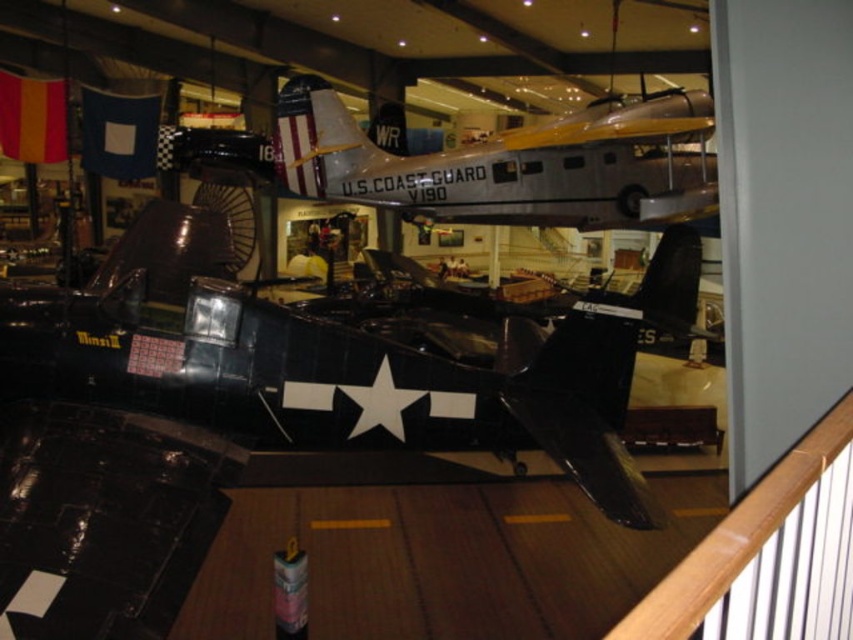
You are a museum guide explaining the layout of the exhibit. You need to inform visitors about the spatial relationship between the shiny black airplane at center and the silver metallic airplane at center. Based on their sizes, which airplane would require more horizontal space if placed side by side on the same display platform?

The silver metallic airplane at center requires more horizontal space because its width is greater than the shiny black airplane at center.

You are a visitor in the museum and want to take a photo of both the shiny black airplane at center and the silver metallic airplane at center. However, you notice that one of them is blocking your view of the other. Which airplane is blocking the view of the other?

The silver metallic airplane at center is behind the shiny black airplane at center, so the shiny black airplane at center is blocking the view of the silver metallic airplane at center.